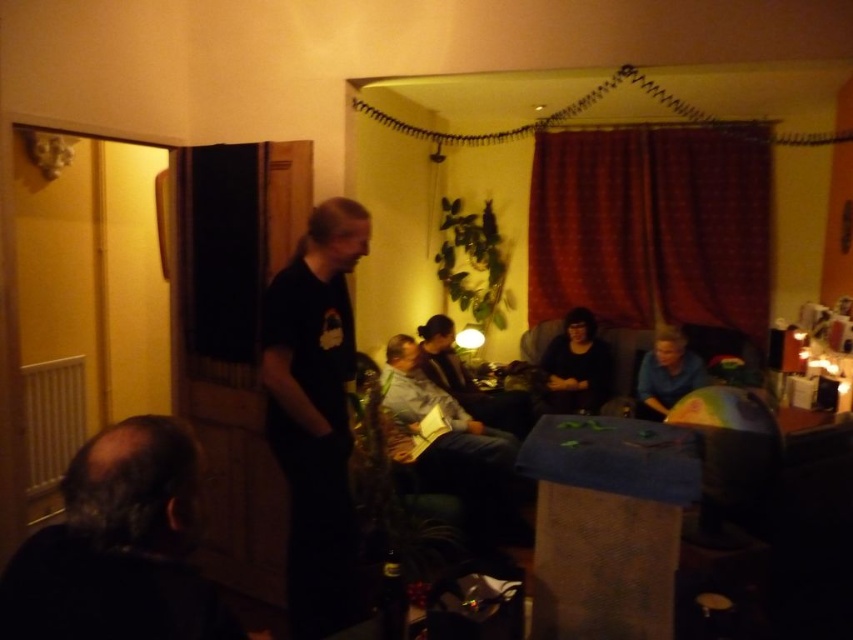
Question: Which object appears closest to the camera in this image?

Choices:
 (A) black matte shirt at left
 (B) dark gray shirt at center
 (C) denim jacket at center
 (D) dark hair at lower left

Answer: (D)

Question: Which point appears farthest from the camera in this image?

Choices:
 (A) (351, 308)
 (B) (21, 573)

Answer: (A)

Question: Estimate the real-world distances between objects in this image. Which object is closer to the dark hair at lower left?

Choices:
 (A) black matte shirt at left
 (B) denim jacket at center
 (C) dark gray shirt at center

Answer: (A)

Question: Does dark hair at lower left have a larger size compared to denim jacket at center?

Choices:
 (A) yes
 (B) no

Answer: (B)

Question: From the image, what is the correct spatial relationship of dark hair at lower left in relation to black matte shirt at left?

Choices:
 (A) below
 (B) above

Answer: (B)

Question: Is black matte shirt at left bigger than dark gray shirt at center?

Choices:
 (A) no
 (B) yes

Answer: (A)